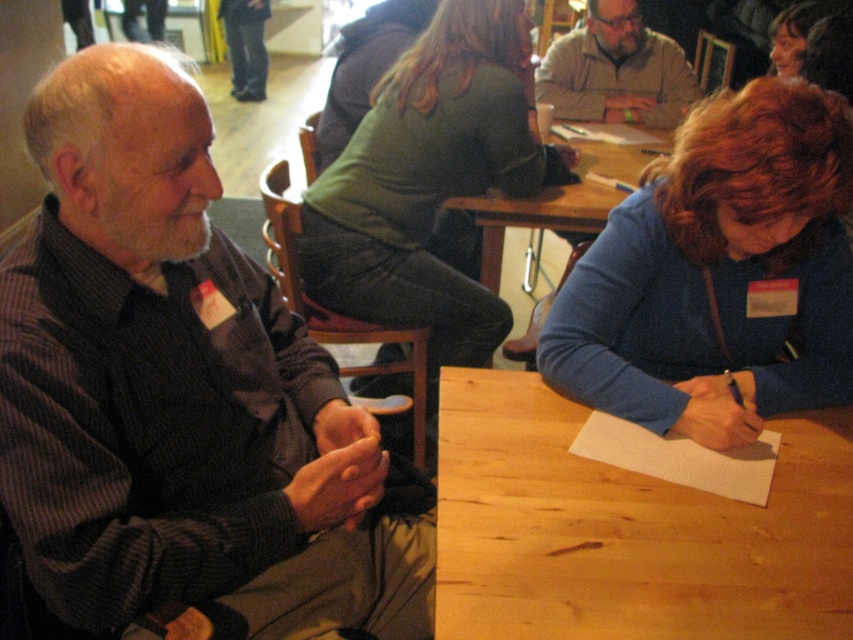
Who is taller, light brown wood at lower right or wooden table at center?

Standing taller between the two is wooden table at center.

What do you see at coordinates (628, 529) in the screenshot? I see `light brown wood at lower right` at bounding box center [628, 529].

Where is `light brown wood at lower right`? light brown wood at lower right is located at coordinates (628, 529).

Who is taller, blue fabric at right or wooden table at center?

With more height is wooden table at center.

Is point (619, 387) farther from camera compared to point (619, 170)?

No, (619, 387) is closer to viewer.

Does point (850, 371) lie in front of point (532, 212)?

That is True.

Identify the location of blue fabric at right. (717, 273).

Who is more distant from viewer, (114, 172) or (631, 458)?

The point (631, 458) is more distant.

Does point (213, 282) come behind point (743, 467)?

No.

At what (x,y) coordinates should I click in order to perform the action: click on dark brown textured sweater at left. Please return your answer as a coordinate pair (x, y). Looking at the image, I should click on (181, 397).